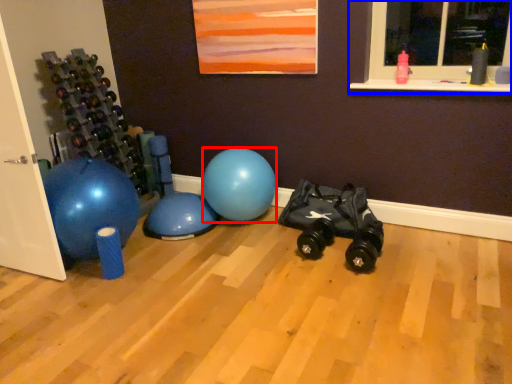
Question: Which object appears farthest to the camera in this image, ball (highlighted by a red box) or window (highlighted by a blue box)?

Choices:
 (A) ball
 (B) window

Answer: (A)